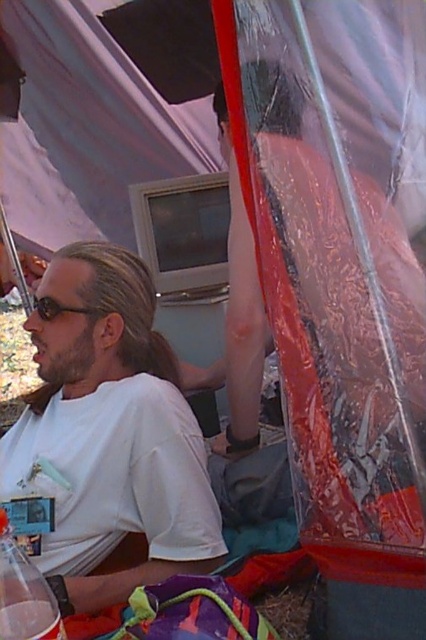
Question: Which point is closer to the camera?

Choices:
 (A) white matte shirt at center
 (B) clear plastic cup at lower left

Answer: (B)

Question: Which point appears farthest from the camera in this image?

Choices:
 (A) (13, 486)
 (B) (60, 627)

Answer: (A)

Question: Which point is closer to the camera taking this photo?

Choices:
 (A) (11, 616)
 (B) (123, 260)

Answer: (A)

Question: Is white matte shirt at center positioned in front of clear plastic cup at lower left?

Choices:
 (A) yes
 (B) no

Answer: (B)

Question: Does white matte shirt at center have a smaller size compared to clear plastic cup at lower left?

Choices:
 (A) yes
 (B) no

Answer: (B)

Question: Considering the relative positions of white matte shirt at center and clear plastic cup at lower left in the image provided, where is white matte shirt at center located with respect to clear plastic cup at lower left?

Choices:
 (A) right
 (B) left

Answer: (B)